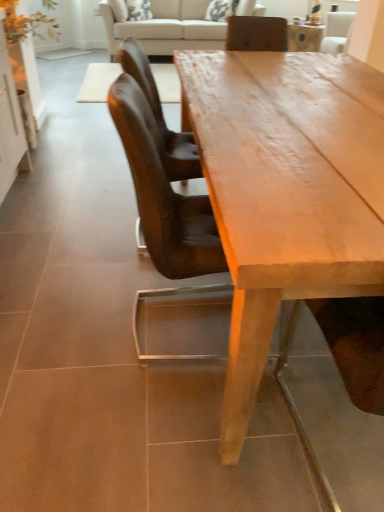
Question: Is leather chair at center, which appears as the 2th chair when viewed from the front, positioned before smooth wooden table at center?

Choices:
 (A) no
 (B) yes

Answer: (A)

Question: From a real-world perspective, is leather chair at center, positioned as the 1th chair in back-to-front order, over smooth wooden table at center?

Choices:
 (A) no
 (B) yes

Answer: (B)

Question: From the image's perspective, does leather chair at center, which appears as the 2th chair when viewed from the front, appear lower than smooth wooden table at center?

Choices:
 (A) no
 (B) yes

Answer: (A)

Question: Does leather chair at center, which appears as the 2th chair when viewed from the front, come behind smooth wooden table at center?

Choices:
 (A) yes
 (B) no

Answer: (A)

Question: Is leather chair at center, which appears as the 2th chair when viewed from the front, placed right next to smooth wooden table at center?

Choices:
 (A) yes
 (B) no

Answer: (B)

Question: Considering the positions of point (273, 184) and point (205, 24), is point (273, 184) closer or farther from the camera than point (205, 24)?

Choices:
 (A) closer
 (B) farther

Answer: (A)

Question: From the image's perspective, is smooth wooden table at center above or below beige fabric couch at upper center?

Choices:
 (A) below
 (B) above

Answer: (A)

Question: Is smooth wooden table at center inside the boundaries of beige fabric couch at upper center, or outside?

Choices:
 (A) outside
 (B) inside

Answer: (A)

Question: Considering their positions, is smooth wooden table at center located in front of or behind beige fabric couch at upper center?

Choices:
 (A) front
 (B) behind

Answer: (A)

Question: In terms of size, does beige fabric couch at upper center appear bigger or smaller than brown leather chair at center, which is counted as the 1th chair, starting from the front?

Choices:
 (A) big
 (B) small

Answer: (A)

Question: Do you think beige fabric couch at upper center is within brown leather chair at center, marked as the second chair in a back-to-front arrangement, or outside of it?

Choices:
 (A) outside
 (B) inside

Answer: (A)

Question: Considering the positions of beige fabric couch at upper center and brown leather chair at center, which is counted as the 1th chair, starting from the front, in the image, is beige fabric couch at upper center wider or thinner than brown leather chair at center, which is counted as the 1th chair, starting from the front,?

Choices:
 (A) wide
 (B) thin

Answer: (A)

Question: From a real-world perspective, is beige fabric couch at upper center positioned above or below brown leather chair at center, marked as the second chair in a back-to-front arrangement?

Choices:
 (A) above
 (B) below

Answer: (B)

Question: Looking at the image, does leather chair at center, which appears as the 2th chair when viewed from the front, seem bigger or smaller compared to beige fabric couch at upper center?

Choices:
 (A) small
 (B) big

Answer: (A)

Question: From a real-world perspective, is leather chair at center, positioned as the 1th chair in back-to-front order, above or below beige fabric couch at upper center?

Choices:
 (A) below
 (B) above

Answer: (B)